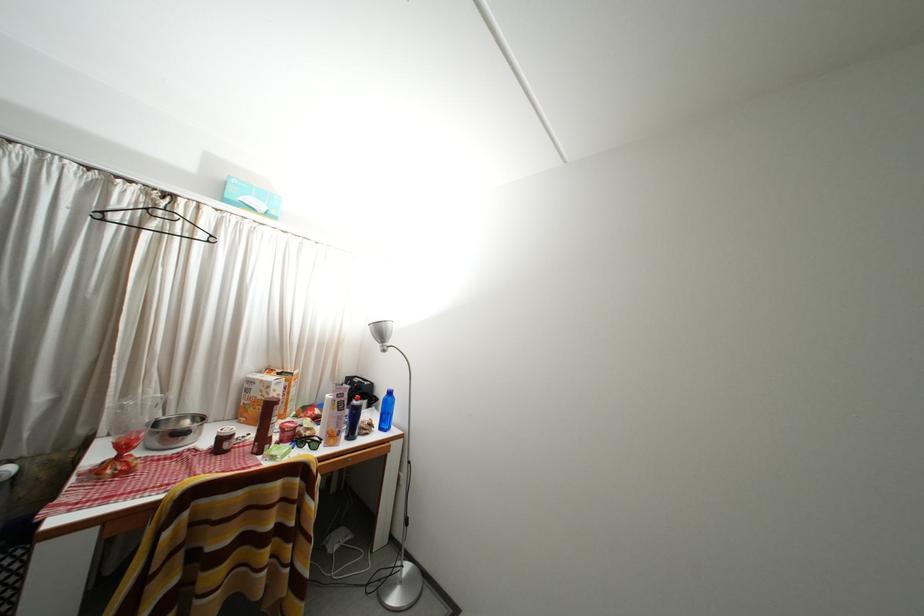
Locate an element on the screen. The height and width of the screenshot is (616, 924). glass jam jar is located at coordinates (224, 440).